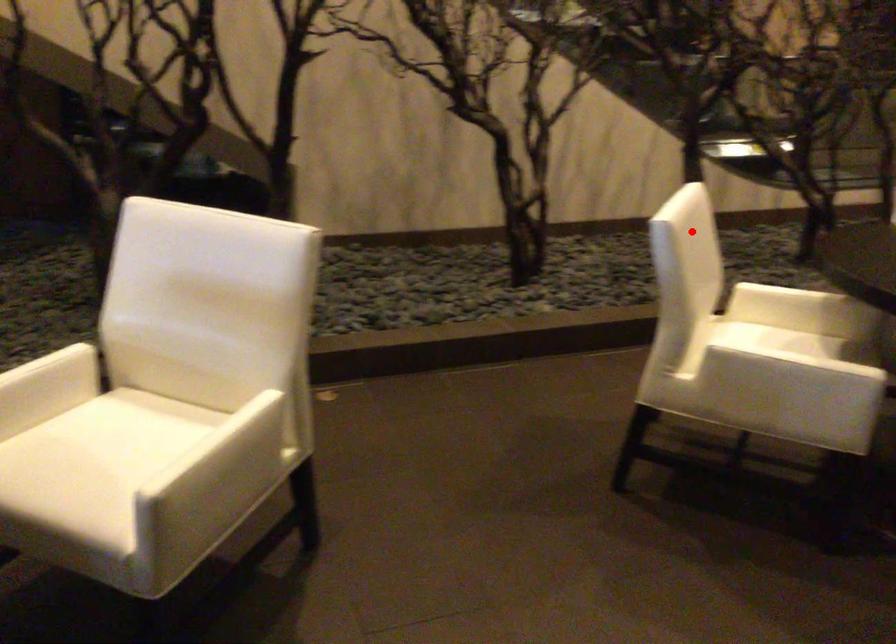
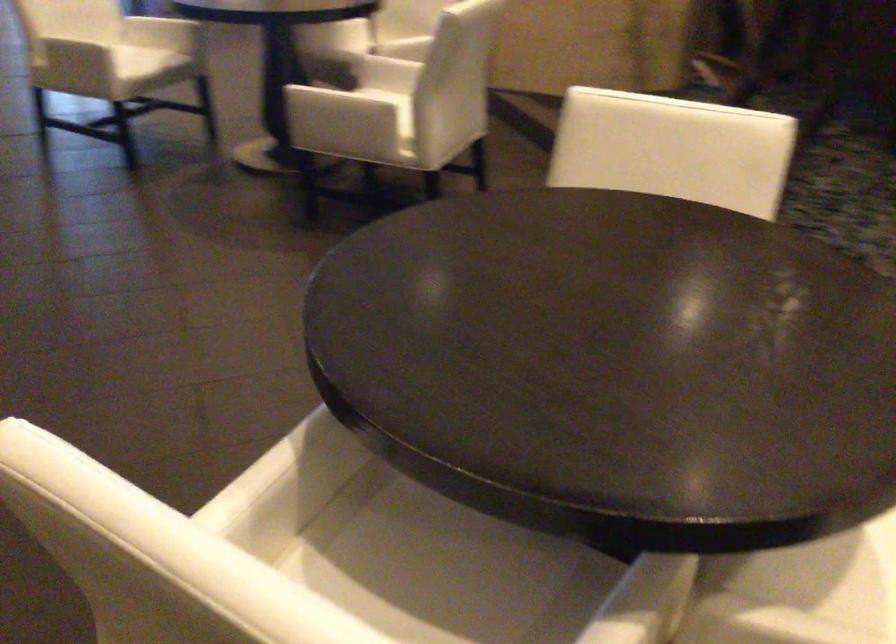
Question: I am providing you with two images of the same scene from different viewpoints. A red point is shown in image1. For the corresponding object point in image2, is it positioned nearer or farther from the camera?

Choices:
 (A) Nearer
 (B) Farther

Answer: (A)